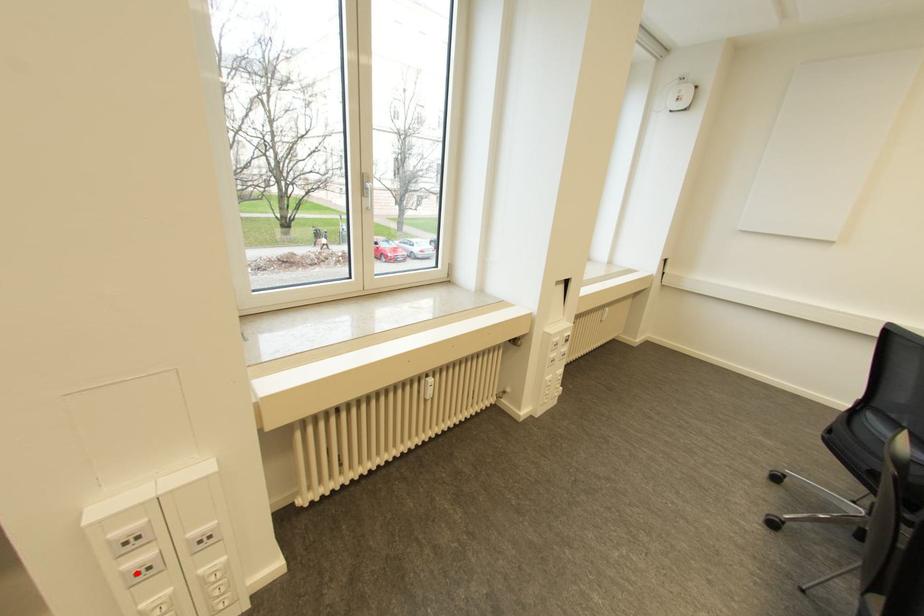
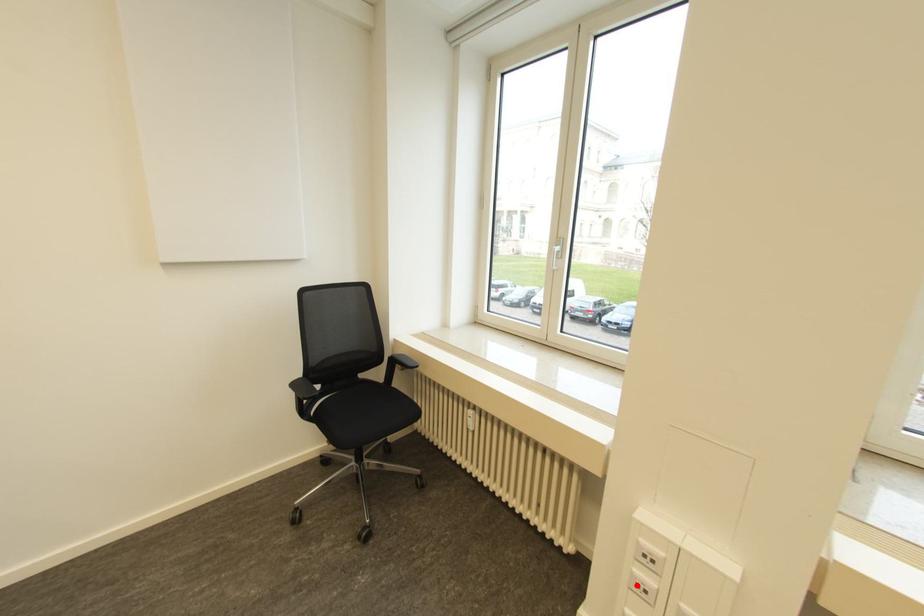
I am providing you with two images of the same scene from different viewpoints. A red point is marked on the first image and another point is marked on the second image. Do the highlighted points in image1 and image2 indicate the same real-world spot?

Yes